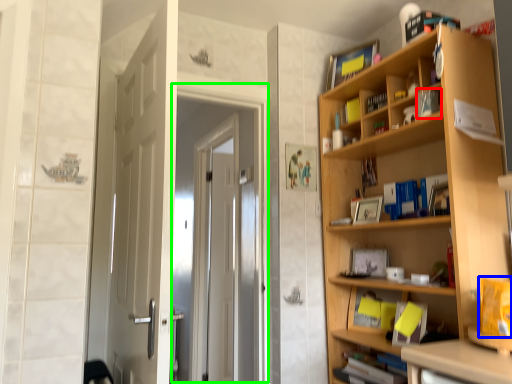
Question: Estimate the real-world distances between objects in this image. Which object is closer to book (highlighted by a red box), book (highlighted by a blue box) or screen door (highlighted by a green box)?

Choices:
 (A) book
 (B) screen door

Answer: (A)